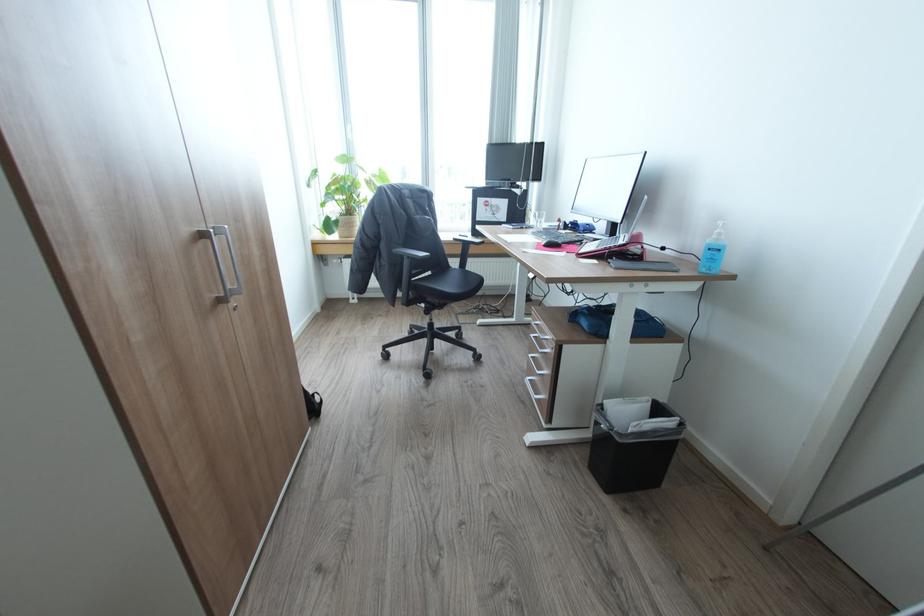
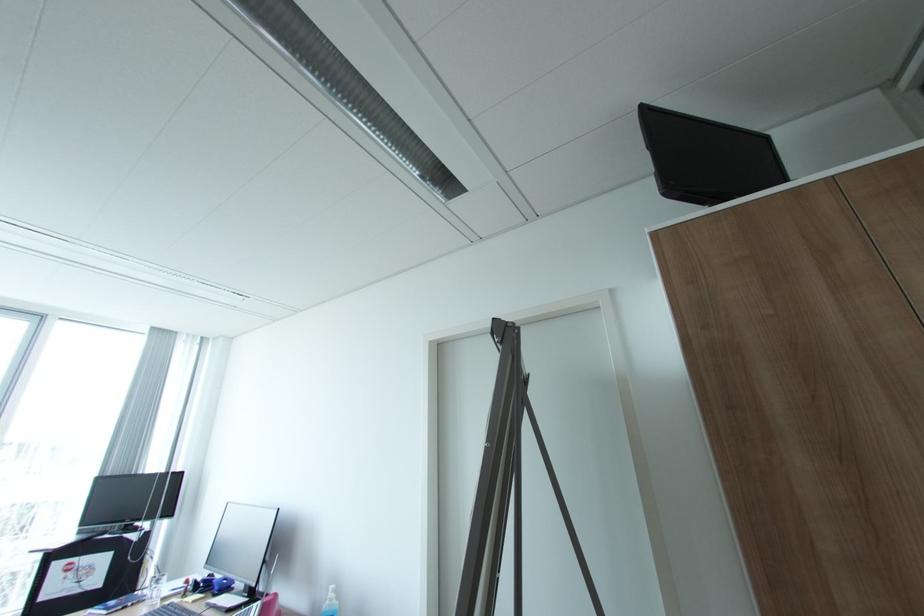
In the second image, find the point that corresponds to (587,229) in the first image.

(222, 588)